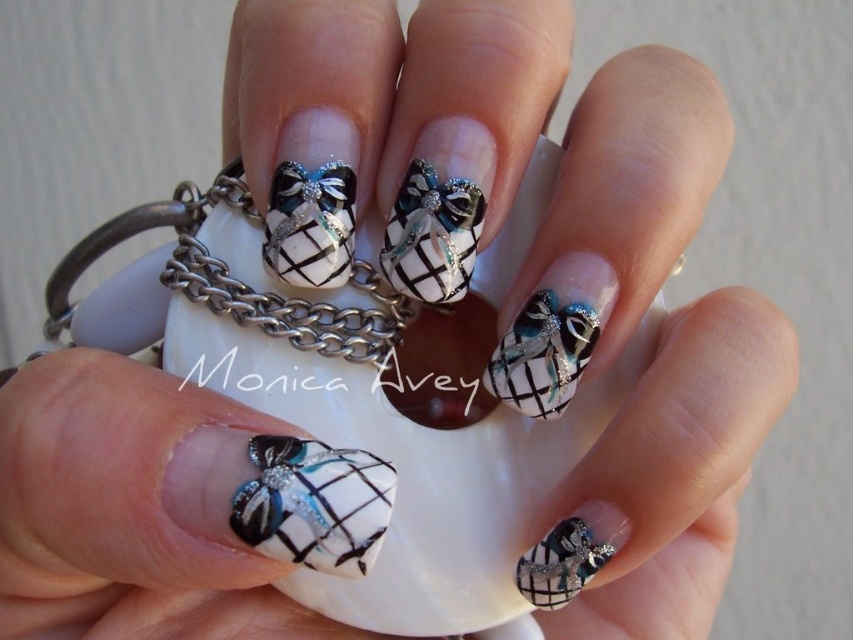
You are a nail artist assessing a client who wants to ensure their nails are properly aligned. They show you their matte black and white nail art with bow at center and matte black and white checkered bow at center. Which of these two has a lower position on the nail?

The matte black and white nail art with bow at center is positioned below the matte black and white checkered bow at center, so it has a lower position on the nail.

You are an artist trying to replicate the nail art design shown in the image. You need to place a matte black and white checkered bow exactly at the center of the nail. Based on the image, is the current position of the matte black and white checkered bow at center correctly placed at the center of the nail?

The 2D location of matte black and white checkered bow at center is at point [310,225], which indicates it is slightly off the exact center. Therefore, the current position is not perfectly centered on the nail.

You are an artist analyzing the composition of a hand holding a figurine. The hand has nails with specific designs. Where is the matte black and white nail art with bow at center located in terms of its 2D coordinates?

The matte black and white nail art with bow at center is located at the 2D coordinates point (312, 502).